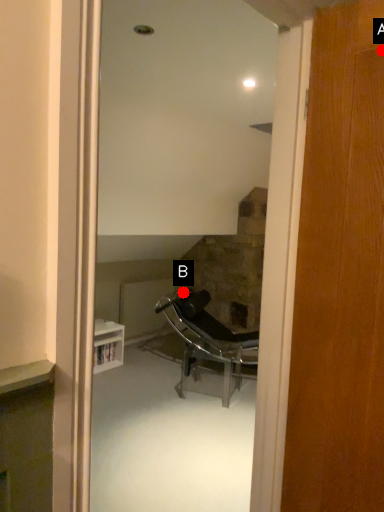
Question: Two points are circled on the image, labeled by A and B beside each circle. Which point is farther from the camera taking this photo?

Choices:
 (A) A is further
 (B) B is further

Answer: (B)